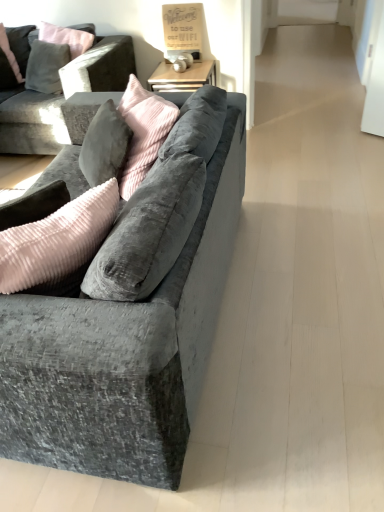
Question: In terms of height, does velvet gray pillow at upper left look taller or shorter compared to velvet grey couch at left, placed as the 2th studio couch when sorted from back to front?

Choices:
 (A) short
 (B) tall

Answer: (A)

Question: Looking at the image, does velvet gray pillow at upper left seem bigger or smaller compared to velvet grey couch at left, the first studio couch from the bottom?

Choices:
 (A) big
 (B) small

Answer: (B)

Question: Considering the real-world distances, which object is farthest from the velvet gray pillow at upper left?

Choices:
 (A) velvet grey couch at left, placed as the 2th studio couch when sorted from back to front
 (B) velvet grey couch at upper left, which ranks as the 1th studio couch in back-to-front order

Answer: (A)

Question: Which object is the farthest from the velvet gray pillow at upper left?

Choices:
 (A) velvet grey couch at left, the second studio couch viewed from the top
 (B) velvet grey couch at upper left, placed as the 2th studio couch when sorted from bottom to top

Answer: (A)